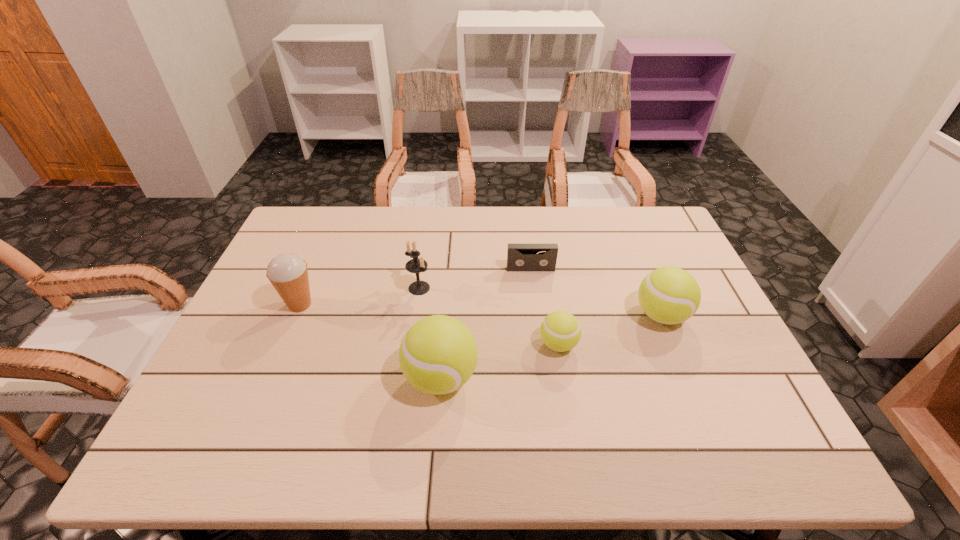
Find the location of a particular element. the leftmost tennis ball is located at coordinates (438, 354).

At what (x,y) coordinates should I click in order to perform the action: click on the shortest tennis ball. Please return your answer as a coordinate pair (x, y). Looking at the image, I should click on (560, 331).

Where is `the rightmost object`? the rightmost object is located at coordinates (669, 295).

This screenshot has width=960, height=540. What are the coordinates of `the second shortest tennis ball` in the screenshot? It's located at (669, 295).

The width and height of the screenshot is (960, 540). Find the location of `the leftmost object`. the leftmost object is located at coordinates (288, 273).

You are a GUI agent. You are given a task and a screenshot of the screen. Output one action in this format:
    pyautogui.click(x=<x>, y=<y>)
    Task: Click on the candle holder
    This screenshot has width=960, height=540.
    Given the screenshot: What is the action you would take?
    [x=416, y=265]

The width and height of the screenshot is (960, 540). I want to click on the farthest object, so click(520, 257).

The height and width of the screenshot is (540, 960). In order to click on free space located 0.250m on the right of the leftmost tennis ball in this screenshot , I will do `click(584, 377)`.

You are a GUI agent. You are given a task and a screenshot of the screen. Output one action in this format:
    pyautogui.click(x=<x>, y=<y>)
    Task: Click on the free location located 0.390m on the right of the shortest tennis ball
    
    Given the screenshot: What is the action you would take?
    pyautogui.click(x=732, y=345)

This screenshot has height=540, width=960. I want to click on blank space located 0.080m on the front of the second shortest tennis ball, so click(x=681, y=362).